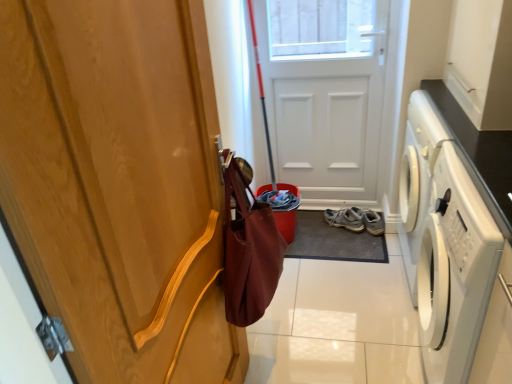
Question: Is wooden door handle at left, which is the second door in right-to-left order, placed right next to light brown suede sneakers at lower center?

Choices:
 (A) no
 (B) yes

Answer: (A)

Question: From the image's perspective, does wooden door handle at left, which is the 1th door from front to back, appear lower than light brown suede sneakers at lower center?

Choices:
 (A) no
 (B) yes

Answer: (A)

Question: From a real-world perspective, is wooden door handle at left, which is the 1th door from front to back, located beneath light brown suede sneakers at lower center?

Choices:
 (A) no
 (B) yes

Answer: (A)

Question: Is wooden door handle at left, marked as the 2th door in a back-to-front arrangement, looking in the opposite direction of light brown suede sneakers at lower center?

Choices:
 (A) no
 (B) yes

Answer: (A)

Question: Is light brown suede sneakers at lower center a part of wooden door handle at left, which is the second door in right-to-left order?

Choices:
 (A) yes
 (B) no

Answer: (B)

Question: Can you confirm if wooden door handle at left, which is the second door in right-to-left order, is positioned to the left of light brown suede sneakers at lower center?

Choices:
 (A) yes
 (B) no

Answer: (A)

Question: Considering the relative sizes of light brown suede sneakers at lower center and dark gray rubber doormat at center in the image provided, is light brown suede sneakers at lower center bigger than dark gray rubber doormat at center?

Choices:
 (A) yes
 (B) no

Answer: (B)

Question: From a real-world perspective, is light brown suede sneakers at lower center on dark gray rubber doormat at center?

Choices:
 (A) yes
 (B) no

Answer: (A)

Question: Is there a large distance between light brown suede sneakers at lower center and dark gray rubber doormat at center?

Choices:
 (A) no
 (B) yes

Answer: (A)

Question: Considering the relative sizes of light brown suede sneakers at lower center and dark gray rubber doormat at center in the image provided, is light brown suede sneakers at lower center thinner than dark gray rubber doormat at center?

Choices:
 (A) yes
 (B) no

Answer: (A)

Question: Could you tell me if light brown suede sneakers at lower center is facing dark gray rubber doormat at center?

Choices:
 (A) yes
 (B) no

Answer: (B)

Question: Does light brown suede sneakers at lower center have a greater height compared to dark gray rubber doormat at center?

Choices:
 (A) no
 (B) yes

Answer: (B)

Question: Is light brown suede sneakers at lower center completely or partially inside white matte door at center, marked as the 1th door in a back-to-front arrangement?

Choices:
 (A) no
 (B) yes

Answer: (A)